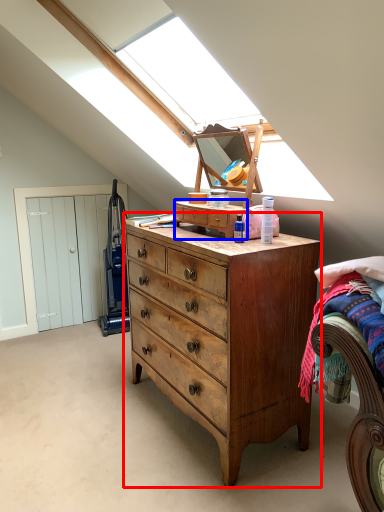
Question: Which point is further to the camera, chest of drawers (highlighted by a red box) or cabinetry (highlighted by a blue box)?

Choices:
 (A) chest of drawers
 (B) cabinetry

Answer: (B)